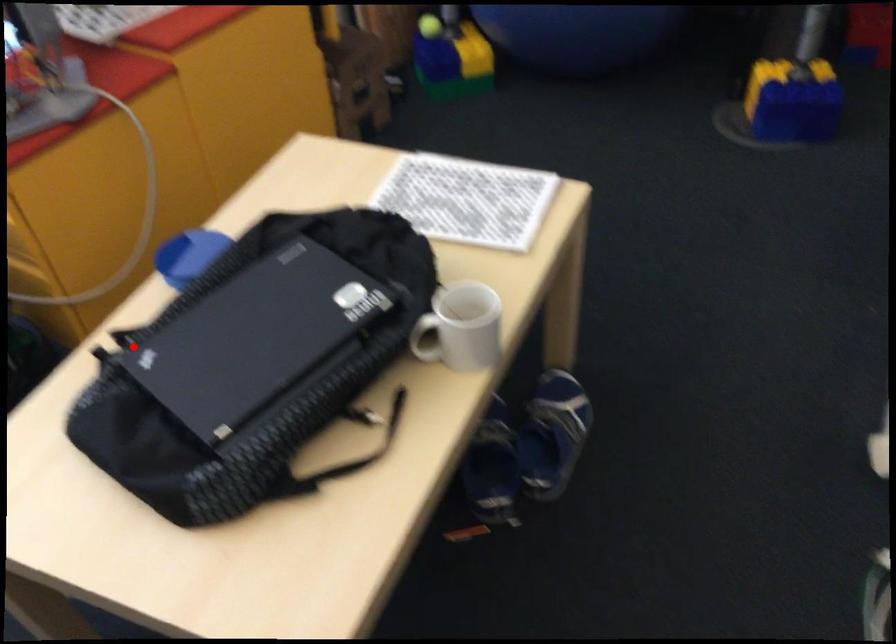
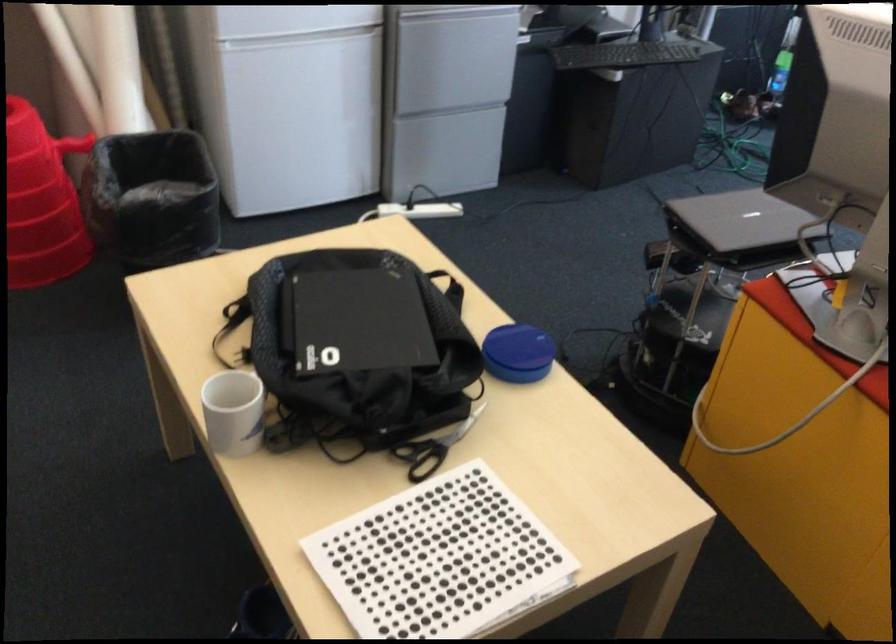
Question: I am providing you with two images of the same scene from different viewpoints. Given a red point in image1, look at the same physical point in image2. Is it:

Choices:
 (A) Closer to the viewpoint
 (B) Farther from the viewpoint

Answer: (B)